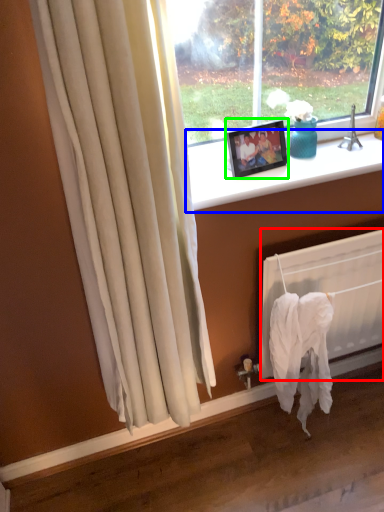
Question: Which object is the closest to the radiator (highlighted by a red box)? Choose among these: window sill (highlighted by a blue box) or picture frame (highlighted by a green box).

Choices:
 (A) window sill
 (B) picture frame

Answer: (A)